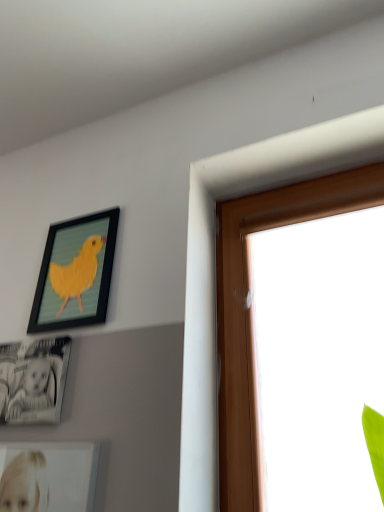
Describe the element at coordinates (33, 380) in the screenshot. This screenshot has height=512, width=384. I see `black glossy photo frame at lower left, which ranks as the 2th picture frame in top-to-bottom order` at that location.

Where is `black glossy photo frame at lower left, which ranks as the 2th picture frame in top-to-bottom order`? This screenshot has width=384, height=512. black glossy photo frame at lower left, which ranks as the 2th picture frame in top-to-bottom order is located at coordinates (33, 380).

The width and height of the screenshot is (384, 512). Describe the element at coordinates (75, 273) in the screenshot. I see `matte black picture frame at upper left, marked as the 2th picture frame in a bottom-to-top arrangement` at that location.

How much space does matte black picture frame at upper left, marked as the 2th picture frame in a bottom-to-top arrangement, occupy vertically?

matte black picture frame at upper left, marked as the 2th picture frame in a bottom-to-top arrangement, is 34.51 centimeters in height.

At what (x,y) coordinates should I click in order to perform the action: click on matte black picture frame at upper left, marked as the 2th picture frame in a bottom-to-top arrangement. Please return your answer as a coordinate pair (x, y). Image resolution: width=384 pixels, height=512 pixels. Looking at the image, I should click on (75, 273).

Identify the location of black glossy photo frame at lower left, which appears as the first picture frame when ordered from the bottom. This screenshot has width=384, height=512. (33, 380).

Between black glossy photo frame at lower left, which appears as the first picture frame when ordered from the bottom, and matte black picture frame at upper left, marked as the 2th picture frame in a bottom-to-top arrangement, which one appears on the right side from the viewer's perspective?

From the viewer's perspective, matte black picture frame at upper left, marked as the 2th picture frame in a bottom-to-top arrangement, appears more on the right side.

Between black glossy photo frame at lower left, which ranks as the 2th picture frame in top-to-bottom order, and matte black picture frame at upper left, the 1th picture frame in the top-to-bottom sequence, which one is positioned behind?

matte black picture frame at upper left, the 1th picture frame in the top-to-bottom sequence, is more distant.

Which point is more forward, [54,385] or [46,261]?

Positioned in front is point [54,385].

From the image's perspective, relative to matte black picture frame at upper left, marked as the 2th picture frame in a bottom-to-top arrangement, is black glossy photo frame at lower left, which appears as the first picture frame when ordered from the bottom, above or below?

From the image's perspective, black glossy photo frame at lower left, which appears as the first picture frame when ordered from the bottom, appears below matte black picture frame at upper left, marked as the 2th picture frame in a bottom-to-top arrangement.

From a real-world perspective, is black glossy photo frame at lower left, which ranks as the 2th picture frame in top-to-bottom order, on matte black picture frame at upper left, marked as the 2th picture frame in a bottom-to-top arrangement?

No, from a real-world perspective, black glossy photo frame at lower left, which ranks as the 2th picture frame in top-to-bottom order, is not on top of matte black picture frame at upper left, marked as the 2th picture frame in a bottom-to-top arrangement.

Is black glossy photo frame at lower left, which ranks as the 2th picture frame in top-to-bottom order, wider than matte black picture frame at upper left, the 1th picture frame in the top-to-bottom sequence?

Correct, the width of black glossy photo frame at lower left, which ranks as the 2th picture frame in top-to-bottom order, exceeds that of matte black picture frame at upper left, the 1th picture frame in the top-to-bottom sequence.

Can you confirm if black glossy photo frame at lower left, which ranks as the 2th picture frame in top-to-bottom order, is shorter than matte black picture frame at upper left, marked as the 2th picture frame in a bottom-to-top arrangement?

Indeed, black glossy photo frame at lower left, which ranks as the 2th picture frame in top-to-bottom order, has a lesser height compared to matte black picture frame at upper left, marked as the 2th picture frame in a bottom-to-top arrangement.

Between black glossy photo frame at lower left, which ranks as the 2th picture frame in top-to-bottom order, and matte black picture frame at upper left, marked as the 2th picture frame in a bottom-to-top arrangement, which one has larger size?

matte black picture frame at upper left, marked as the 2th picture frame in a bottom-to-top arrangement, is bigger.

Could matte black picture frame at upper left, the 1th picture frame in the top-to-bottom sequence, be considered to be inside black glossy photo frame at lower left, which ranks as the 2th picture frame in top-to-bottom order?

No, matte black picture frame at upper left, the 1th picture frame in the top-to-bottom sequence, is not a part of black glossy photo frame at lower left, which ranks as the 2th picture frame in top-to-bottom order.

Are black glossy photo frame at lower left, which appears as the first picture frame when ordered from the bottom, and matte black picture frame at upper left, marked as the 2th picture frame in a bottom-to-top arrangement, far apart?

black glossy photo frame at lower left, which appears as the first picture frame when ordered from the bottom, is near matte black picture frame at upper left, marked as the 2th picture frame in a bottom-to-top arrangement, not far away.

Is black glossy photo frame at lower left, which appears as the first picture frame when ordered from the bottom, facing towards matte black picture frame at upper left, the 1th picture frame in the top-to-bottom sequence?

No, black glossy photo frame at lower left, which appears as the first picture frame when ordered from the bottom, is not turned towards matte black picture frame at upper left, the 1th picture frame in the top-to-bottom sequence.

Where is `picture frame on the left of matte black picture frame at upper left, the 1th picture frame in the top-to-bottom sequence`? This screenshot has width=384, height=512. picture frame on the left of matte black picture frame at upper left, the 1th picture frame in the top-to-bottom sequence is located at coordinates (33, 380).

From the picture: Can you confirm if matte black picture frame at upper left, marked as the 2th picture frame in a bottom-to-top arrangement, is positioned to the left of black glossy photo frame at lower left, which appears as the first picture frame when ordered from the bottom?

In fact, matte black picture frame at upper left, marked as the 2th picture frame in a bottom-to-top arrangement, is to the right of black glossy photo frame at lower left, which appears as the first picture frame when ordered from the bottom.

Which is behind, matte black picture frame at upper left, marked as the 2th picture frame in a bottom-to-top arrangement, or black glossy photo frame at lower left, which ranks as the 2th picture frame in top-to-bottom order?

matte black picture frame at upper left, marked as the 2th picture frame in a bottom-to-top arrangement, is further away from the camera.

Is point (89, 250) positioned before point (4, 390)?

No, it is not.

From the image's perspective, is matte black picture frame at upper left, the 1th picture frame in the top-to-bottom sequence, positioned above or below black glossy photo frame at lower left, which ranks as the 2th picture frame in top-to-bottom order?

From the image's perspective, matte black picture frame at upper left, the 1th picture frame in the top-to-bottom sequence, appears above black glossy photo frame at lower left, which ranks as the 2th picture frame in top-to-bottom order.

From a real-world perspective, is matte black picture frame at upper left, marked as the 2th picture frame in a bottom-to-top arrangement, on black glossy photo frame at lower left, which ranks as the 2th picture frame in top-to-bottom order?

Correct, in the physical world, matte black picture frame at upper left, marked as the 2th picture frame in a bottom-to-top arrangement, is higher than black glossy photo frame at lower left, which ranks as the 2th picture frame in top-to-bottom order.

Can you confirm if matte black picture frame at upper left, the 1th picture frame in the top-to-bottom sequence, is wider than black glossy photo frame at lower left, which appears as the first picture frame when ordered from the bottom?

No, matte black picture frame at upper left, the 1th picture frame in the top-to-bottom sequence, is not wider than black glossy photo frame at lower left, which appears as the first picture frame when ordered from the bottom.

Can you confirm if matte black picture frame at upper left, marked as the 2th picture frame in a bottom-to-top arrangement, is taller than black glossy photo frame at lower left, which ranks as the 2th picture frame in top-to-bottom order?

Correct, matte black picture frame at upper left, marked as the 2th picture frame in a bottom-to-top arrangement, is much taller as black glossy photo frame at lower left, which ranks as the 2th picture frame in top-to-bottom order.

Looking at the image, does matte black picture frame at upper left, the 1th picture frame in the top-to-bottom sequence, seem bigger or smaller compared to black glossy photo frame at lower left, which appears as the first picture frame when ordered from the bottom?

Considering their sizes, matte black picture frame at upper left, the 1th picture frame in the top-to-bottom sequence, takes up more space than black glossy photo frame at lower left, which appears as the first picture frame when ordered from the bottom.

Based on the photo, is black glossy photo frame at lower left, which appears as the first picture frame when ordered from the bottom, surrounded by matte black picture frame at upper left, the 1th picture frame in the top-to-bottom sequence?

No, black glossy photo frame at lower left, which appears as the first picture frame when ordered from the bottom, is not inside matte black picture frame at upper left, the 1th picture frame in the top-to-bottom sequence.

Looking at this image, is matte black picture frame at upper left, marked as the 2th picture frame in a bottom-to-top arrangement, not close to black glossy photo frame at lower left, which ranks as the 2th picture frame in top-to-bottom order?

No, there isn't a large distance between matte black picture frame at upper left, marked as the 2th picture frame in a bottom-to-top arrangement, and black glossy photo frame at lower left, which ranks as the 2th picture frame in top-to-bottom order.

Is matte black picture frame at upper left, the 1th picture frame in the top-to-bottom sequence, facing towards black glossy photo frame at lower left, which appears as the first picture frame when ordered from the bottom?

No, matte black picture frame at upper left, the 1th picture frame in the top-to-bottom sequence, is not aimed at black glossy photo frame at lower left, which appears as the first picture frame when ordered from the bottom.

Where is `picture frame that appears above the black glossy photo frame at lower left, which ranks as the 2th picture frame in top-to-bottom order (from the image's perspective)`? picture frame that appears above the black glossy photo frame at lower left, which ranks as the 2th picture frame in top-to-bottom order (from the image's perspective) is located at coordinates (75, 273).

Find the location of `picture frame above the black glossy photo frame at lower left, which appears as the first picture frame when ordered from the bottom (from a real-world perspective)`. picture frame above the black glossy photo frame at lower left, which appears as the first picture frame when ordered from the bottom (from a real-world perspective) is located at coordinates (75, 273).

Identify the location of picture frame behind the black glossy photo frame at lower left, which appears as the first picture frame when ordered from the bottom. (75, 273).